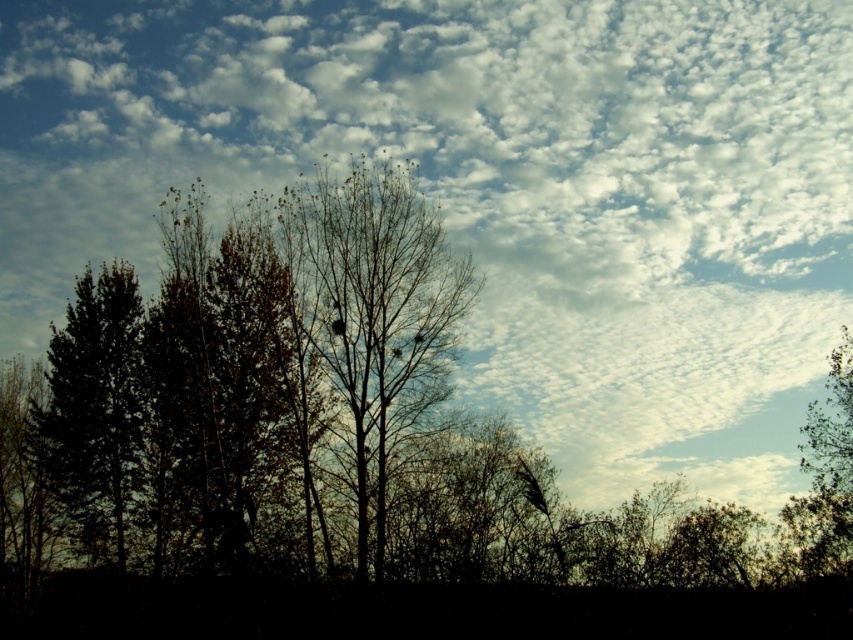
Based on the scene described, which tree has a greater width when comparing the dark green leafy tree at left and the green leafy tree at right?

The dark green leafy tree at left might be wider than the green leafy tree at right according to the description.

You are an observer looking at the scene. Which object is positioned higher in the image, the bare branches at center or the green leafy tree at right?

The bare branches at center is positioned higher than the green leafy tree at right in the image.

You are an ornithologist observing the scene from a distance. You notice a bird perched on a branch. Based on the coordinates provided in the description, can you determine if the bird is on the bare branches at center?

The bare branches at center is located at point [370,324], so yes, the bird is perched on the bare branches at center as the coordinates match the location of the branches.